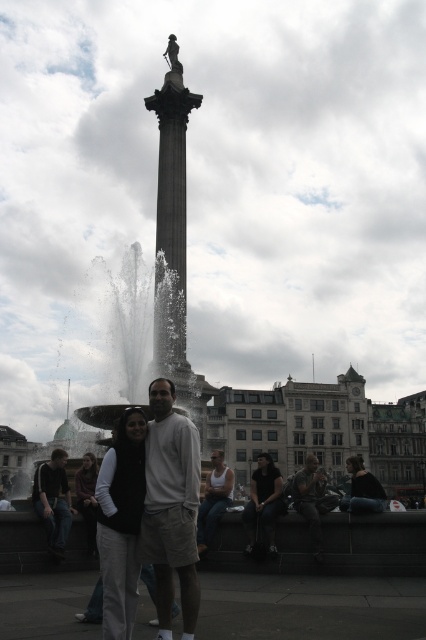
Is white cotton shirt at center in front of white stone fountain at center?

Yes, white cotton shirt at center is closer to the viewer.

Which is above, white cotton shirt at center or white stone fountain at center?

white stone fountain at center

Identify the location of white cotton shirt at center. (170, 508).

Between white stone fountain at center and dark brown leather jacket at lower left, which one is positioned lower?

dark brown leather jacket at lower left

Can you confirm if white stone fountain at center is thinner than dark brown leather jacket at lower left?

In fact, white stone fountain at center might be wider than dark brown leather jacket at lower left.

Does point (140, 308) come closer to viewer compared to point (66, 496)?

No, it is not.

This screenshot has height=640, width=426. Identify the location of white stone fountain at center. (132, 317).

Is white stone fountain at center positioned in front of matte black jacket at lower left?

No, it is not.

Identify the location of white stone fountain at center. The width and height of the screenshot is (426, 640). coord(132,317).

Locate an element on the screen. white stone fountain at center is located at coordinates (132, 317).